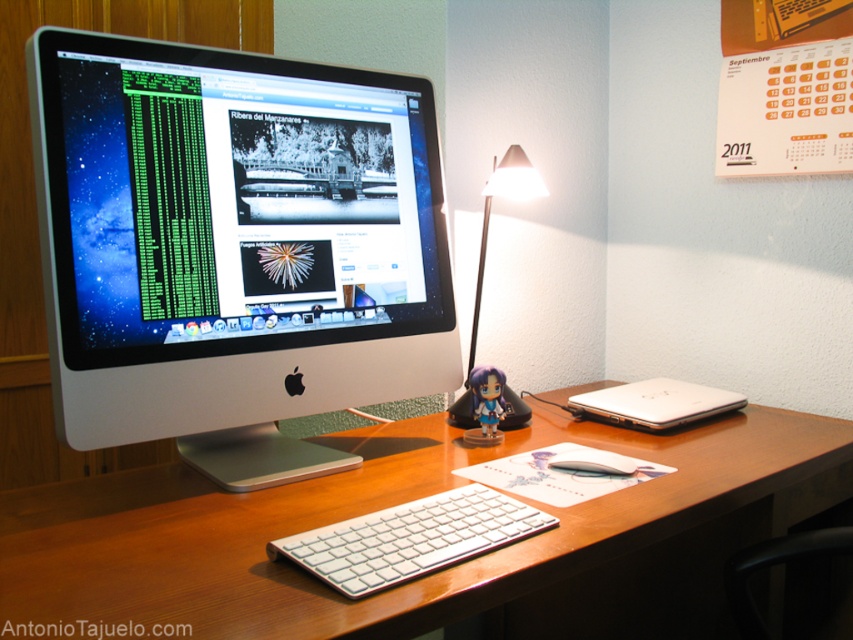
You are standing directly in front of the iMac computer on the wooden desk. There is a point labeled as point (61, 241) on the desk. If you want to reach this point without moving your feet, can you estimate whether it is within your arm reach?

The point (61, 241) is 33.81 inches away from the camera. Since the average human arm length is about 25 to 30 inches, it is likely out of arm reach unless you can stretch further.

You are setting up a new monitor and a figurine on your desk. The white plastic monitor at center and the matte plastic figurine at center are both placed there. If you want to know which one takes up more space, which object is larger?

The white plastic monitor at center is bigger than the matte plastic figurine at center, so it takes up more space.

You are arranging items on your desk and want to place a small notebook between the matte black desk lamp at center and the matte plastic figurine at center. The notebook is 5 inches wide. Will it fit in the space between them?

The distance between the matte black desk lamp at center and the matte plastic figurine at center is 5.34 inches. Since the notebook is 5 inches wide, it will fit with a small amount of space remaining on either side.